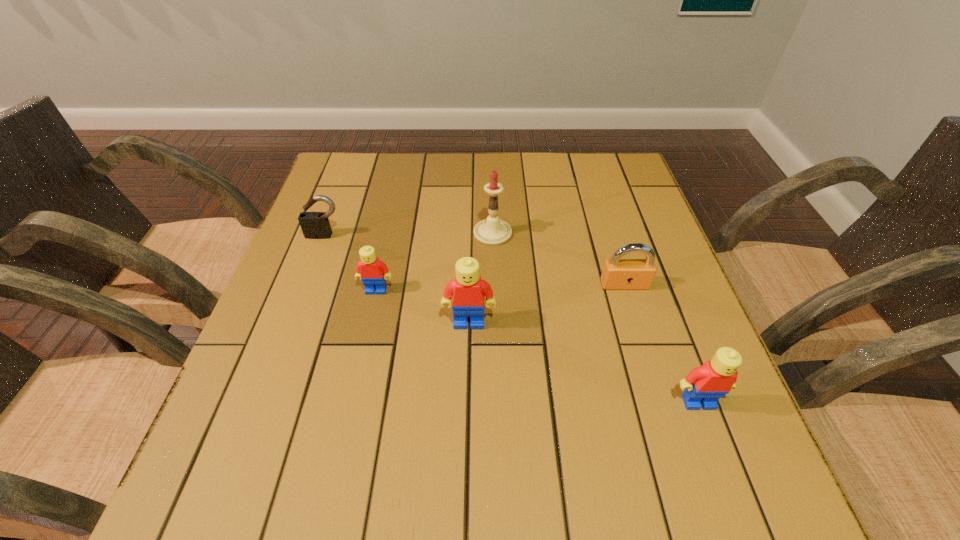
Where is `unoccupied position between the second Lego from left to right and the shortest Lego`? Image resolution: width=960 pixels, height=540 pixels. unoccupied position between the second Lego from left to right and the shortest Lego is located at coordinates (422, 306).

The image size is (960, 540). Identify the location of empty space that is in between the nearest object and the farther padlock. (512, 319).

Find the location of a particular element. The height and width of the screenshot is (540, 960). unoccupied position between the left padlock and the fifth object from right to left is located at coordinates click(x=350, y=263).

Where is `unoccupied position between the second object from left to right and the candle`? This screenshot has width=960, height=540. unoccupied position between the second object from left to right and the candle is located at coordinates click(x=435, y=261).

What are the coordinates of `object that stands as the second closest to the leftmost object` in the screenshot? It's located at (492, 231).

This screenshot has height=540, width=960. Find the location of `object that is the fifth closest to the nearer padlock`. object that is the fifth closest to the nearer padlock is located at coordinates (315, 225).

Where is `Lego that can be found as the second closest to the second nearest object`? Image resolution: width=960 pixels, height=540 pixels. Lego that can be found as the second closest to the second nearest object is located at coordinates (704, 385).

The height and width of the screenshot is (540, 960). I want to click on Lego that is the nearest to the farthest Lego, so tap(468, 291).